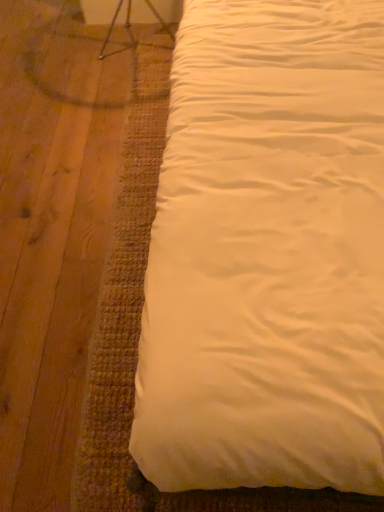
The width and height of the screenshot is (384, 512). Find the location of `free point below metallic silver swivel chair at upper left (from a real-world perspective)`. free point below metallic silver swivel chair at upper left (from a real-world perspective) is located at coordinates (133, 42).